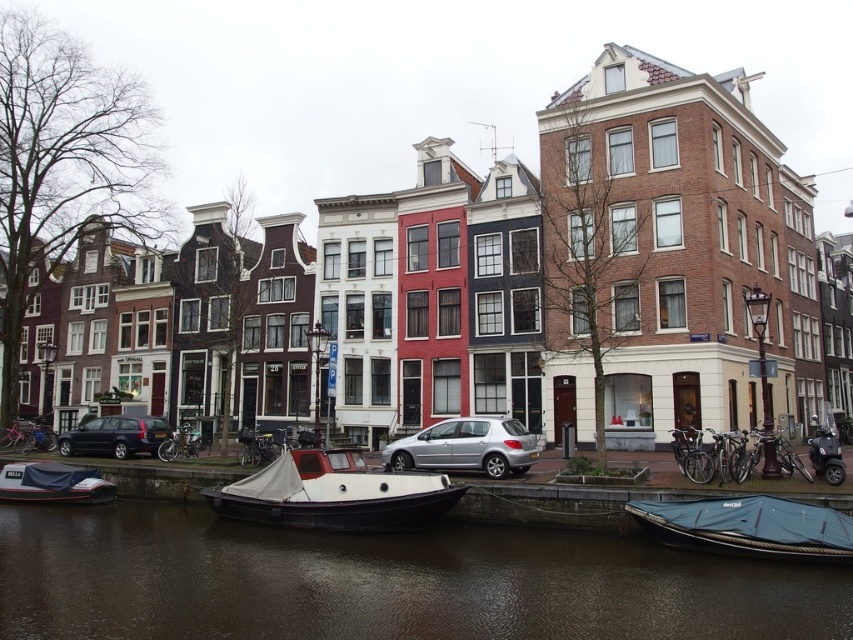
Is white matte boat at center above matte black station wagon at lower left?

No, white matte boat at center is not above matte black station wagon at lower left.

Who is positioned more to the left, white matte boat at center or matte black station wagon at lower left?

matte black station wagon at lower left is more to the left.

Image resolution: width=853 pixels, height=640 pixels. I want to click on white matte boat at center, so click(334, 493).

Who is taller, white matte boat at lower left or matte black station wagon at lower left?

With more height is matte black station wagon at lower left.

Does white matte boat at lower left come behind matte black station wagon at lower left?

No.

The width and height of the screenshot is (853, 640). What do you see at coordinates (53, 483) in the screenshot?
I see `white matte boat at lower left` at bounding box center [53, 483].

The width and height of the screenshot is (853, 640). Identify the location of white matte boat at lower left. (53, 483).

Is point (781, 502) positioned in front of point (495, 419)?

Yes, it is in front of point (495, 419).

Consider the image. Can you confirm if teal canvas boat at lower right is positioned to the left of silver metallic car at center?

In fact, teal canvas boat at lower right is to the right of silver metallic car at center.

Locate an element on the screen. The height and width of the screenshot is (640, 853). teal canvas boat at lower right is located at coordinates (749, 528).

You are a GUI agent. You are given a task and a screenshot of the screen. Output one action in this format:
    pyautogui.click(x=<x>, y=<y>)
    Task: Click on the teal canvas boat at lower right
    The height and width of the screenshot is (640, 853).
    Given the screenshot: What is the action you would take?
    pyautogui.click(x=749, y=528)